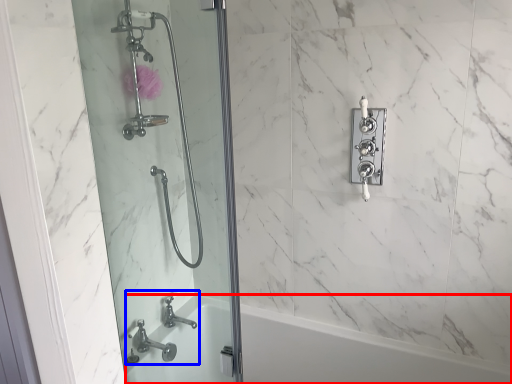
Question: Which object is closer to the camera taking this photo, bath (highlighted by a red box) or sink (highlighted by a blue box)?

Choices:
 (A) bath
 (B) sink

Answer: (A)